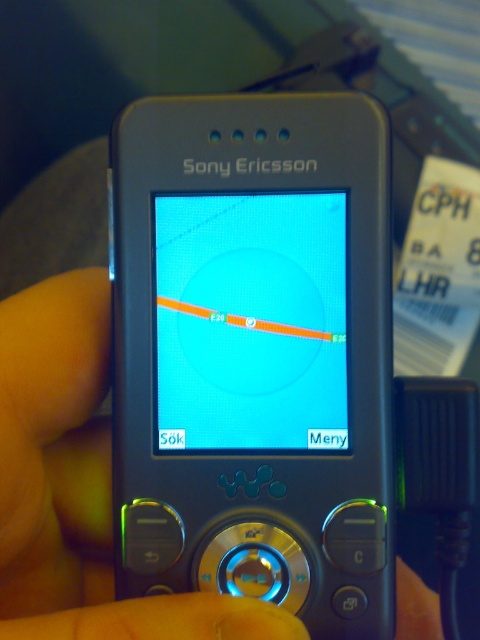
Who is shorter, metallic gray hand at center or blue glossy screen at center?

blue glossy screen at center

Who is positioned more to the right, metallic gray hand at center or blue glossy screen at center?

Positioned to the right is blue glossy screen at center.

In order to click on metallic gray hand at center in this screenshot , I will do `click(79, 484)`.